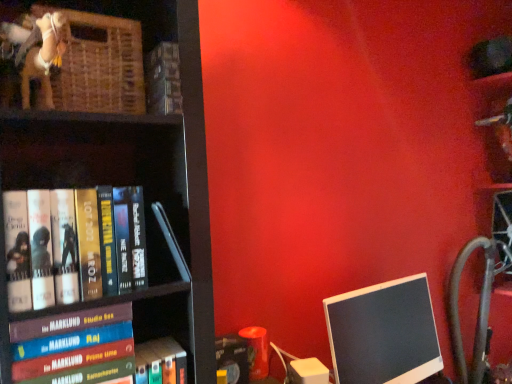
In order to face black glossy monitor at lower right, should I rotate leftwards or rightwards?

It's best to rotate right around 17.610 degrees.

What is the approximate height of hardcover book at left, which is the 3th book from top to bottom?

hardcover book at left, which is the 3th book from top to bottom, is 8.76 inches in height.

Measure the distance between hardcover book at left, marked as the second book in a top-to-bottom arrangement, and camera.

28.74 inches.

The height and width of the screenshot is (384, 512). Describe the element at coordinates (163, 79) in the screenshot. I see `hardcover book at upper center, the fifth book in the bottom-to-top sequence` at that location.

Find the location of a particular element. The height and width of the screenshot is (384, 512). hardcover book at lower left, which is counted as the fourth book, starting from the top is located at coordinates (164, 361).

From the image's perspective, is hardcover book at left, marked as the second book in a top-to-bottom arrangement, under hardcover book at left, marked as the third book in a bottom-to-top arrangement?

Incorrect, from the image's perspective, hardcover book at left, marked as the second book in a top-to-bottom arrangement, is higher than hardcover book at left, marked as the third book in a bottom-to-top arrangement.

Which is behind, hardcover book at left, marked as the second book in a top-to-bottom arrangement, or hardcover book at left, which is the 3th book from top to bottom?

hardcover book at left, marked as the second book in a top-to-bottom arrangement.

The image size is (512, 384). Find the location of `book that appears on the left of hardcover book at left, marked as the second book in a top-to-bottom arrangement`. book that appears on the left of hardcover book at left, marked as the second book in a top-to-bottom arrangement is located at coordinates (74, 347).

Based on the photo, from a real-world perspective, between hardcover book at left, marked as the second book in a top-to-bottom arrangement, and hardcover book at left, which is the 3th book from top to bottom, who is vertically lower?

In real-world perspective, hardcover book at left, which is the 3th book from top to bottom, is lower.

Considering the sizes of objects black glossy monitor at lower right and hardcover book at lower left, which is counted as the fourth book, starting from the top, in the image provided, who is smaller, black glossy monitor at lower right or hardcover book at lower left, which is counted as the fourth book, starting from the top,?

hardcover book at lower left, which is counted as the fourth book, starting from the top.

Identify the location of book that is the 2nd one above the black glossy monitor at lower right (from a real-world perspective). The image size is (512, 384). (164, 361).

Is black glossy monitor at lower right positioned with its back to hardcover book at lower left, which is counted as the fourth book, starting from the top?

No, black glossy monitor at lower right's orientation is not away from hardcover book at lower left, which is counted as the fourth book, starting from the top.

Would you say hardcover book at lower left, which is counted as the fourth book, starting from the top, is part of black glossy monitor at lower right's contents?

No, hardcover book at lower left, which is counted as the fourth book, starting from the top, is not inside black glossy monitor at lower right.

Is black plastic monitor at right in contact with woven wood basket at upper left?

No, black plastic monitor at right is not next to woven wood basket at upper left.

In the scene shown: Do you think black plastic monitor at right is within woven wood basket at upper left, or outside of it?

black plastic monitor at right is spatially situated outside woven wood basket at upper left.

Considering the positions of objects black plastic monitor at right and woven wood basket at upper left in the image provided, who is in front, black plastic monitor at right or woven wood basket at upper left?

Positioned in front is woven wood basket at upper left.

Which of these two, black plastic monitor at right or woven wood basket at upper left, is wider?

black plastic monitor at right.

From the picture: From a real-world perspective, is hardcover book at left, marked as the second book in a top-to-bottom arrangement, physically located above or below black glossy monitor at lower right?

hardcover book at left, marked as the second book in a top-to-bottom arrangement, is above black glossy monitor at lower right.

From the image's perspective, is hardcover book at left, marked as the second book in a top-to-bottom arrangement, over black glossy monitor at lower right?

Yes, from the image's perspective, hardcover book at left, marked as the second book in a top-to-bottom arrangement, is above black glossy monitor at lower right.

Considering the positions of objects hardcover book at left, which is the 3th book from top to bottom, and hardcover book at upper center, the fifth book in the bottom-to-top sequence, in the image provided, who is more to the right, hardcover book at left, which is the 3th book from top to bottom, or hardcover book at upper center, the fifth book in the bottom-to-top sequence,?

hardcover book at upper center, the fifth book in the bottom-to-top sequence, is more to the right.

From the image's perspective, count 2nd books upward from the hardcover book at left, marked as the third book in a bottom-to-top arrangement, and point to it. Please provide its 2D coordinates.

[(163, 79)]

Considering the points (133, 370) and (177, 55), which point is in front, point (133, 370) or point (177, 55)?

Positioned in front is point (133, 370).

Are hardcover book at left, which is the 3th book from top to bottom, and hardcover book at upper center, arranged as the first book when viewed from the top, located far from each other?

hardcover book at left, which is the 3th book from top to bottom, is near hardcover book at upper center, arranged as the first book when viewed from the top, not far away.

Visually, is hardcover book at left, marked as the third book in a bottom-to-top arrangement, positioned to the left or to the right of hardcover book at lower left, the 2th book from the bottom?

From the image, it's evident that hardcover book at left, marked as the third book in a bottom-to-top arrangement, is to the left of hardcover book at lower left, the 2th book from the bottom.

Which of these two, hardcover book at left, marked as the third book in a bottom-to-top arrangement, or hardcover book at lower left, the 2th book from the bottom, is smaller?

Smaller between the two is hardcover book at lower left, the 2th book from the bottom.

From a real-world perspective, does hardcover book at left, which is the 3th book from top to bottom, stand above hardcover book at lower left, the 2th book from the bottom?

Yes, from a real-world perspective, hardcover book at left, which is the 3th book from top to bottom, is above hardcover book at lower left, the 2th book from the bottom.

Between hardcover book at left, which is the 3th book from top to bottom, and hardcover book at lower left, the 2th book from the bottom, which one has less height?

hardcover book at lower left, the 2th book from the bottom, is shorter.

Looking at the image, does hardcover book at left, the 4th book when ordered from bottom to top, seem bigger or smaller compared to hardcover book at lower left, which is counted as the fourth book, starting from the top?

Clearly, hardcover book at left, the 4th book when ordered from bottom to top, is larger in size than hardcover book at lower left, which is counted as the fourth book, starting from the top.

Is hardcover book at left, the 4th book when ordered from bottom to top, facing away from hardcover book at lower left, the 2th book from the bottom?

No.

From a real-world perspective, is hardcover book at left, marked as the second book in a top-to-bottom arrangement, physically below hardcover book at lower left, the 2th book from the bottom?

No, from a real-world perspective, hardcover book at left, marked as the second book in a top-to-bottom arrangement, is not beneath hardcover book at lower left, the 2th book from the bottom.

From the image's perspective, is hardcover book at left, marked as the second book in a top-to-bottom arrangement, above or below hardcover book at lower left, the 2th book from the bottom?

Clearly, from the image's perspective, hardcover book at left, marked as the second book in a top-to-bottom arrangement, is above hardcover book at lower left, the 2th book from the bottom.

At what (x,y) coordinates should I click in order to perform the action: click on book that is the 1st one when counting rightward from the hardcover book at left, marked as the third book in a bottom-to-top arrangement. Please return your answer as a coordinate pair (x, y). The image size is (512, 384). Looking at the image, I should click on (73, 245).

Where is `the 2nd book located above the black glossy monitor at lower right (from a real-world perspective)`? The width and height of the screenshot is (512, 384). the 2nd book located above the black glossy monitor at lower right (from a real-world perspective) is located at coordinates (164, 361).

Consider the image. Based on their spatial positions, is matte black book at lower center, the first book when ordered from bottom to top, or hardcover book at left, the 4th book when ordered from bottom to top, closer to black plastic monitor at right?

matte black book at lower center, the first book when ordered from bottom to top.

Considering their positions, is black plastic monitor at right positioned closer to hardcover book at lower left, the 2th book from the bottom, than woven wood basket at upper left?

Among the two, woven wood basket at upper left is located nearer to hardcover book at lower left, the 2th book from the bottom.

Based on their spatial positions, is black glossy monitor at lower right or hardcover book at lower left, which is counted as the fourth book, starting from the top, further from black plastic monitor at right?

Among the two, hardcover book at lower left, which is counted as the fourth book, starting from the top, is located further to black plastic monitor at right.

Considering their positions, is hardcover book at upper center, the fifth book in the bottom-to-top sequence, positioned closer to black plastic monitor at right than hardcover book at left, marked as the second book in a top-to-bottom arrangement?

Among the two, hardcover book at left, marked as the second book in a top-to-bottom arrangement, is located nearer to black plastic monitor at right.

Looking at the image, which one is located closer to black glossy monitor at lower right, hardcover book at upper center, arranged as the first book when viewed from the top, or black plastic monitor at right?

black plastic monitor at right lies closer to black glossy monitor at lower right than the other object.

From the image, which object appears to be farther from matte black book at lower center, the first book when ordered from bottom to top, hardcover book at left, marked as the second book in a top-to-bottom arrangement, or hardcover book at upper center, the fifth book in the bottom-to-top sequence?

hardcover book at upper center, the fifth book in the bottom-to-top sequence.

From the image, which object appears to be farther from hardcover book at left, the 4th book when ordered from bottom to top, hardcover book at lower left, which is counted as the fourth book, starting from the top, or black plastic monitor at right?

The object further to hardcover book at left, the 4th book when ordered from bottom to top, is black plastic monitor at right.

Looking at the image, which one is located closer to matte black book at lower center, the first book when ordered from bottom to top, black glossy monitor at lower right or woven wood basket at upper left?

black glossy monitor at lower right.

In order to click on book between woven wood basket at upper left and hardcover book at left, the 4th book when ordered from bottom to top, from top to bottom in this screenshot , I will do (x=163, y=79).

In order to click on computer monitor between woven wood basket at upper left and black plastic monitor at right from left to right in this screenshot , I will do point(384,333).

You are a GUI agent. You are given a task and a screenshot of the screen. Output one action in this format:
    pyautogui.click(x=<x>, y=<y>)
    Task: Click on the book between hardcover book at upper center, the fifth book in the bottom-to-top sequence, and black plastic monitor at right, in the horizontal direction
    
    Given the screenshot: What is the action you would take?
    pyautogui.click(x=233, y=358)

Locate an element on the screen. The width and height of the screenshot is (512, 384). book between hardcover book at left, the 4th book when ordered from bottom to top, and hardcover book at lower left, the 2th book from the bottom, from top to bottom is located at coordinates (74, 347).